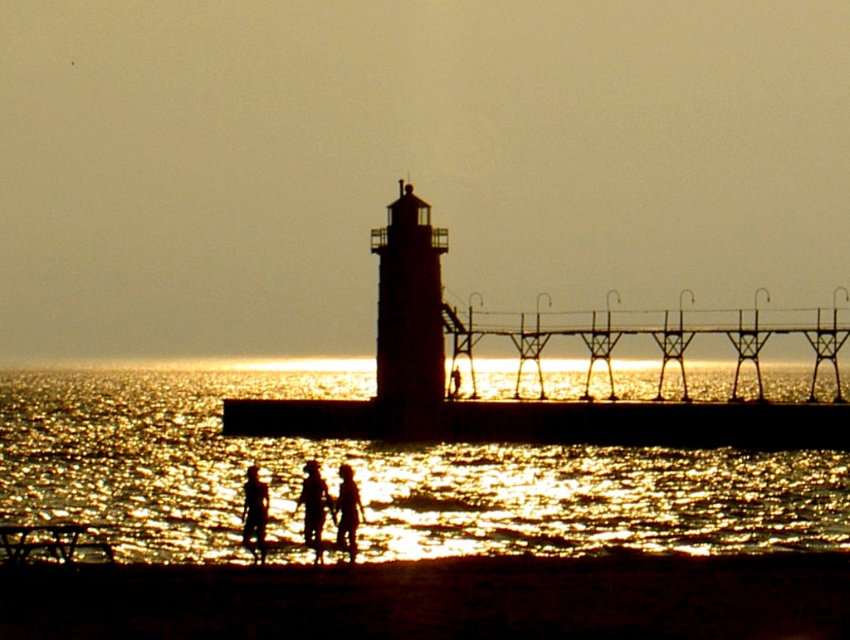
Question: Which object is positioned farthest from the shiny golden water at lower center?

Choices:
 (A) silhouette figures at lower center
 (B) dark sand at lower center
 (C) silhouette figure at center

Answer: (B)

Question: Does silhouette figures at lower center appear over smooth skin person at lower center?

Choices:
 (A) yes
 (B) no

Answer: (A)

Question: Is shiny golden water at lower center wider than smooth skin person at lower center?

Choices:
 (A) no
 (B) yes

Answer: (B)

Question: Which point is closer to the camera?

Choices:
 (A) silhouette figure at center
 (B) dark sand at lower center

Answer: (B)

Question: Which point is closer to the camera taking this photo?

Choices:
 (A) (262, 488)
 (B) (350, 541)
 (C) (615, 588)

Answer: (C)

Question: Does shiny golden water at lower center appear on the left side of silhouette figure at lower center?

Choices:
 (A) yes
 (B) no

Answer: (B)